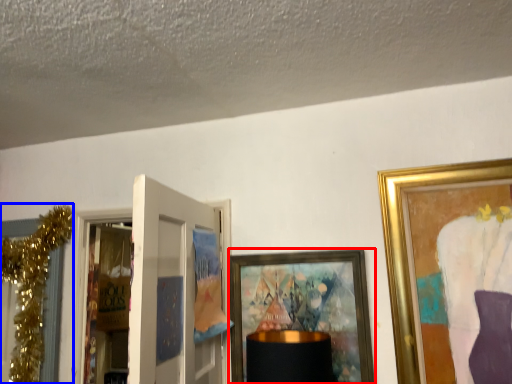
Question: Among these objects, which one is nearest to the camera, picture frame (highlighted by a red box) or christmas decoration (highlighted by a blue box)?

Choices:
 (A) picture frame
 (B) christmas decoration

Answer: (A)